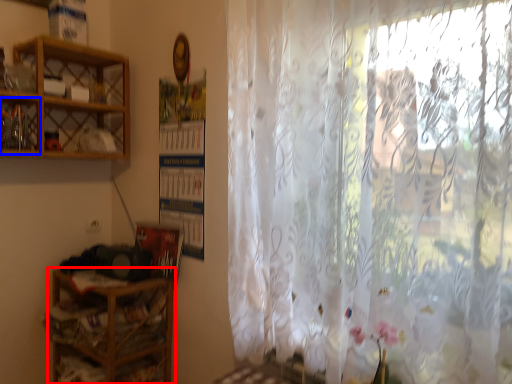
Question: Which object appears closest to the camera in this image, shelf (highlighted by a red box) or cabinet (highlighted by a blue box)?

Choices:
 (A) shelf
 (B) cabinet

Answer: (B)